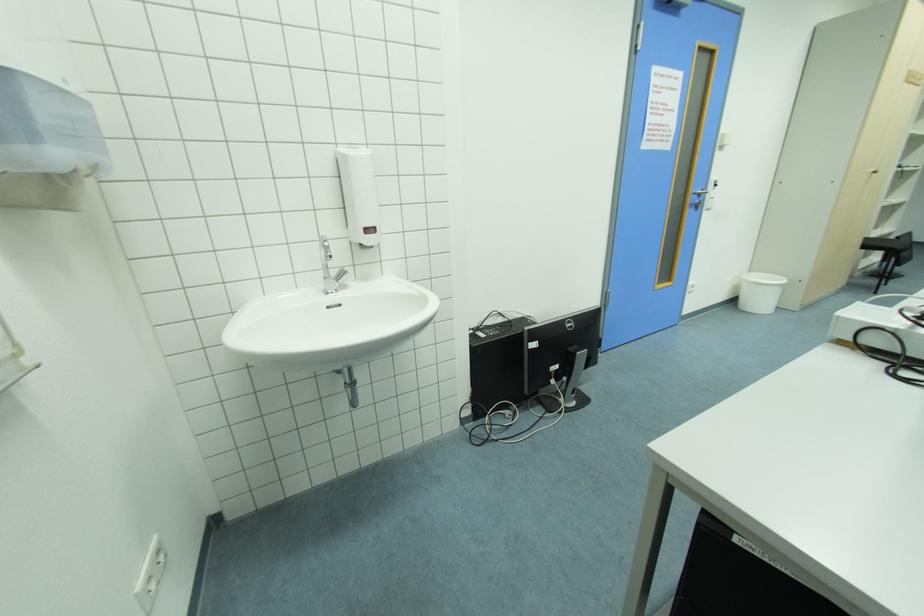
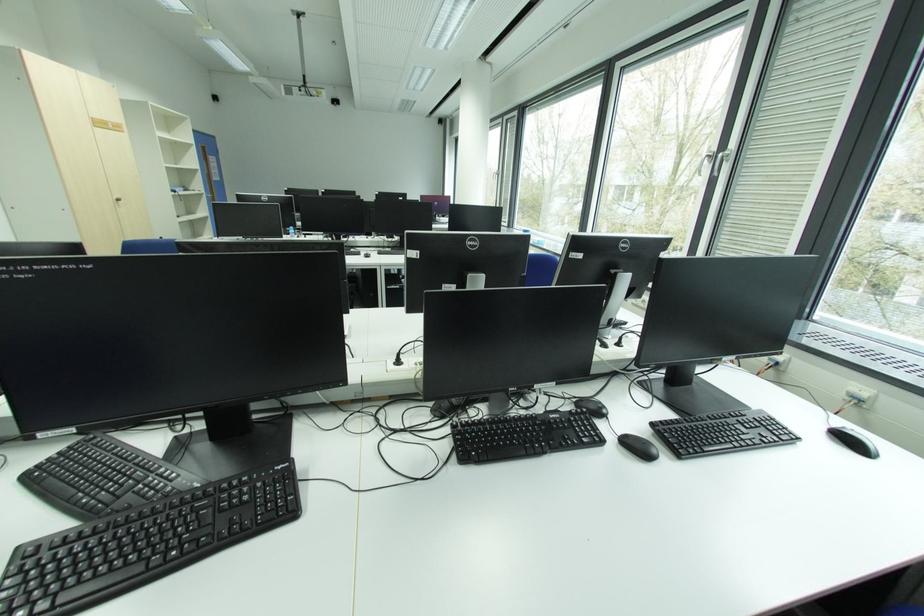
In the second image, find the point that corresponds to the point at 878,172 in the first image.

(120, 199)